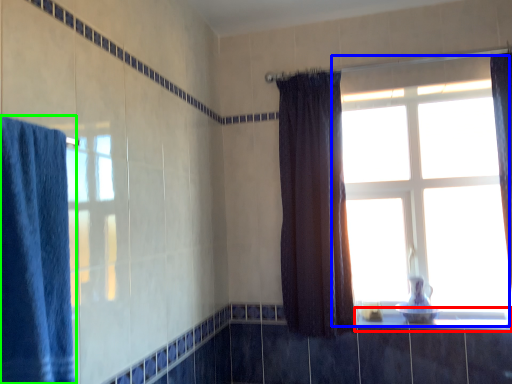
Question: Which is farther away from window sill (highlighted by a red box)? window (highlighted by a blue box) or curtain (highlighted by a green box)?

Choices:
 (A) window
 (B) curtain

Answer: (B)